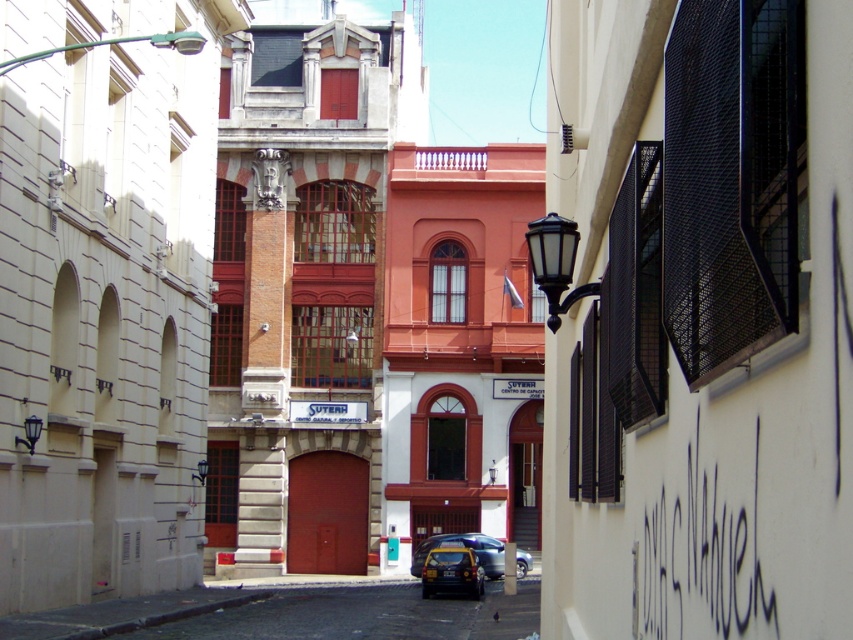
Who is higher up, shiny black car at center or metallic blue car at center?

shiny black car at center

Is shiny black car at center to the left of metallic blue car at center from the viewer's perspective?

Indeed, shiny black car at center is positioned on the left side of metallic blue car at center.

Does point (440, 566) come closer to viewer compared to point (450, 538)?

Yes, point (440, 566) is in front of point (450, 538).

You are a GUI agent. You are given a task and a screenshot of the screen. Output one action in this format:
    pyautogui.click(x=<x>, y=<y>)
    Task: Click on the shiny black car at center
    This screenshot has width=853, height=640.
    Given the screenshot: What is the action you would take?
    pyautogui.click(x=451, y=572)